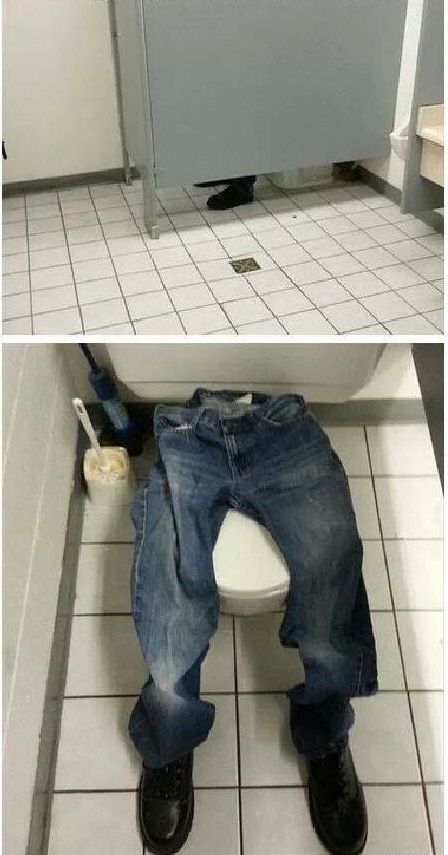
Where is `space below brush holder`? This screenshot has height=855, width=448. space below brush holder is located at coordinates (107, 516).